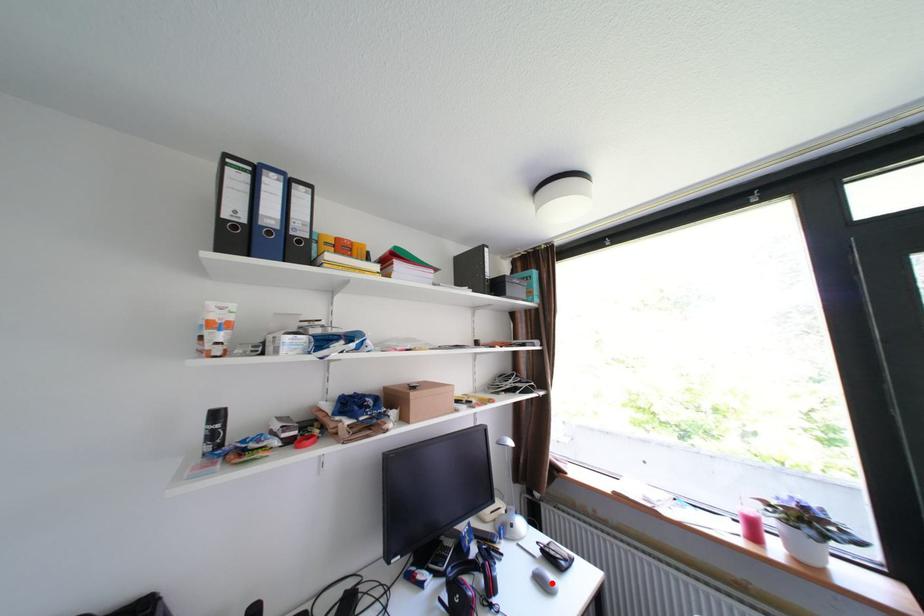
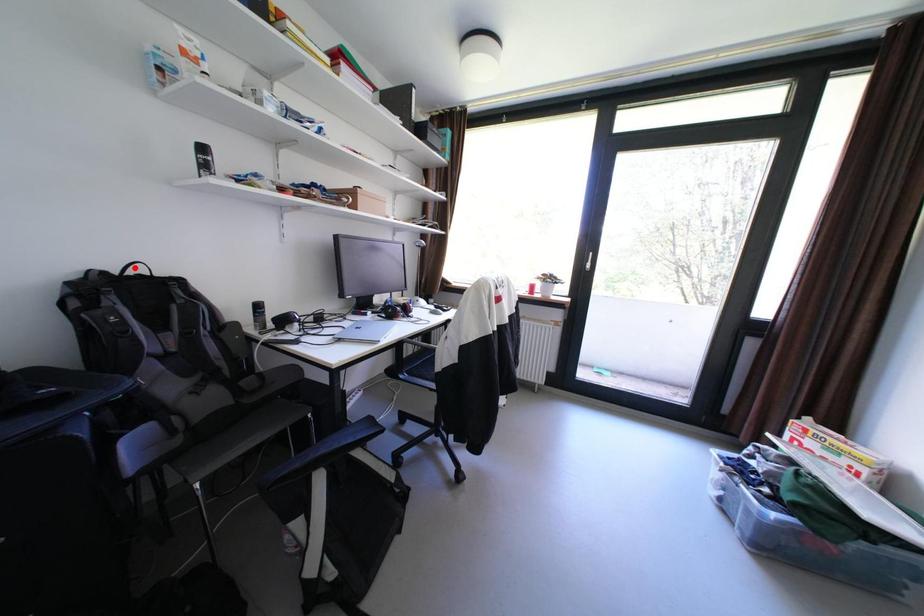
I am providing you with two images of the same scene from different viewpoints. A red point is marked on the first image and another point is marked on the second image. Is the red point in image1 aligned with the point shown in image2?

No